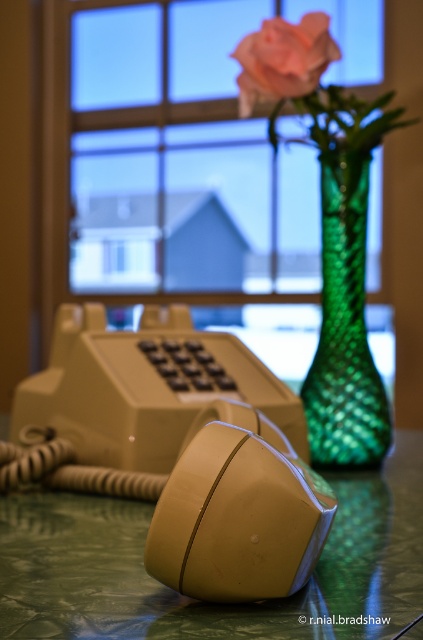
You are a delivery robot that is 0.5 meters wide. You need to move from the beige rubberized mouse at center to the transparent glass window at upper center. Can you pass through the space between them without hitting anything?

The transparent glass window at upper center is 1.66 meters away from the beige rubberized mouse at center. Since the robot is 0.5 meters wide, there is sufficient space between them to pass through without any obstruction.

You are organizing a desk and need to place both the beige rubberized mouse at center and the soft pink rose at center. Which object requires more space on the desk?

The soft pink rose at center requires more space on the desk than the beige rubberized mouse at center because the beige rubberized mouse at center occupies less space than the soft pink rose at center.